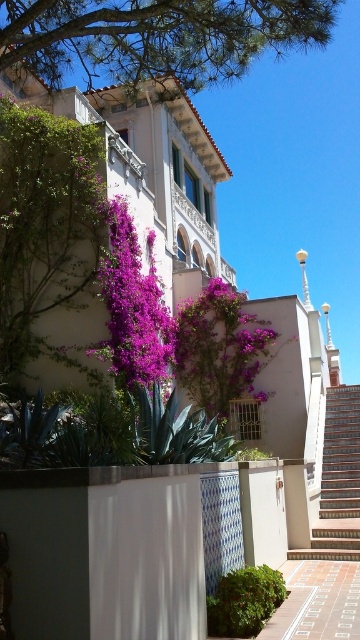
Question: Is green leafy tree at upper center in front of purple leafy plant at upper left?

Choices:
 (A) yes
 (B) no

Answer: (A)

Question: Which of the following is the closest to the observer?

Choices:
 (A) (344, 454)
 (B) (150, 292)
 (C) (246, 618)
 (D) (321, 40)

Answer: (C)

Question: Considering the relative positions of purple leafy plant at upper left and green leafy bush at lower center in the image provided, where is purple leafy plant at upper left located with respect to green leafy bush at lower center?

Choices:
 (A) below
 (B) above

Answer: (B)

Question: Which point is closer to the camera?

Choices:
 (A) green leafy tree at upper center
 (B) terracotta tiled stairs at center
 (C) purple leafy plant at upper left

Answer: (A)

Question: Which point is closer to the camera?

Choices:
 (A) (77, 237)
 (B) (219, 628)
 (C) (168, 1)

Answer: (B)

Question: Is green leafy tree at upper center smaller than terracotta tiled stairs at center?

Choices:
 (A) yes
 (B) no

Answer: (B)